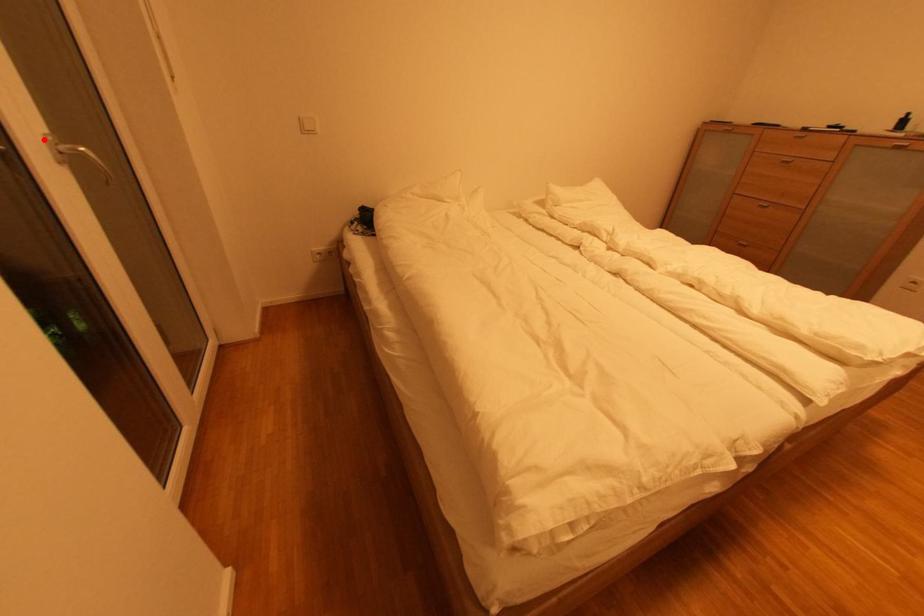
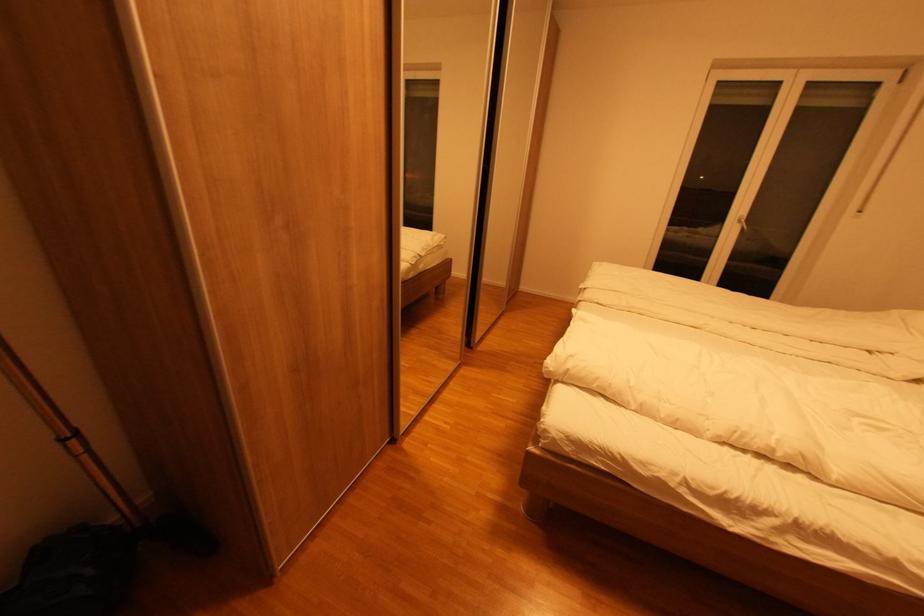
Locate, in the second image, the point that corresponds to the highlighted location in the first image.

(744, 216)